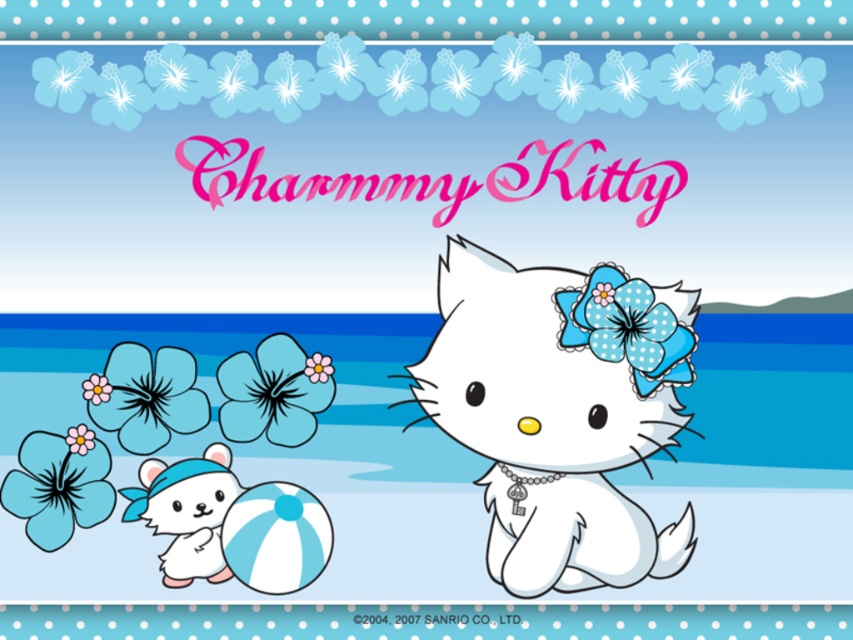
Which is above, blue striped beach ball at lower left or matte blue flower at upper left?

Result: matte blue flower at upper left is above.

Is blue striped beach ball at lower left wider than matte blue flower at upper left?

Yes, blue striped beach ball at lower left is wider than matte blue flower at upper left.

Who is more distant from viewer, (256, 557) or (91, 435)?

The point (256, 557) is more distant.

Identify the location of blue striped beach ball at lower left. (276, 538).

Who is taller, white matte cat at center or blue striped beach ball at lower left?

white matte cat at center is taller.

Can you confirm if white matte cat at center is positioned to the right of blue striped beach ball at lower left?

→ Correct, you'll find white matte cat at center to the right of blue striped beach ball at lower left.

Is point (613, 488) behind point (280, 550)?

That is True.

The width and height of the screenshot is (853, 640). I want to click on white matte cat at center, so click(x=560, y=412).

Is pink paper flower at lower left above matte blue flower at upper left?

Correct, pink paper flower at lower left is located above matte blue flower at upper left.

Who is taller, pink paper flower at lower left or matte blue flower at upper left?

pink paper flower at lower left is taller.

Is point (84, 380) behind point (91, 449)?

Yes.

Find the location of a particular element. Image resolution: width=853 pixels, height=640 pixels. pink paper flower at lower left is located at coordinates tap(96, 388).